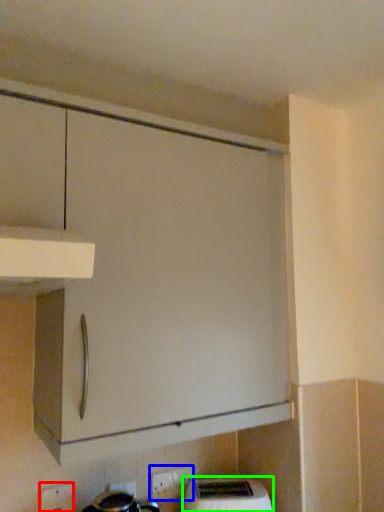
Question: Which object is positioned farthest from electric outlet (highlighted by a red box)? Select from electric outlet (highlighted by a blue box) and home appliance (highlighted by a green box).

Choices:
 (A) electric outlet
 (B) home appliance

Answer: (B)